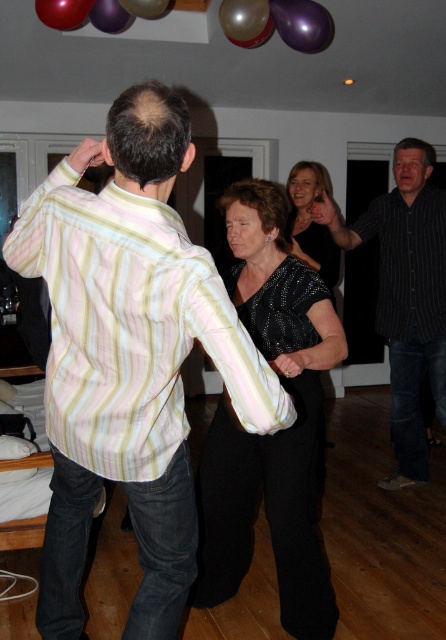
Can you confirm if striped cotton shirt at center is taller than glossy red balloon at upper left?

Indeed, striped cotton shirt at center has a greater height compared to glossy red balloon at upper left.

Is point (152, 547) behind point (37, 8)?

No, it is not.

Find the location of `striped cotton shirt at center`. striped cotton shirt at center is located at coordinates (129, 356).

Can you confirm if black sequined blouse at center is positioned to the left of striped shirt at right?

Indeed, black sequined blouse at center is positioned on the left side of striped shirt at right.

Is point (260, 451) positioned after point (371, 228)?

No.

Between point (275, 472) and point (396, 381), which one is positioned in front?

Point (275, 472) is more forward.

Locate an element on the screen. This screenshot has height=640, width=446. black sequined blouse at center is located at coordinates (276, 433).

Does striped shirt at right come behind metallic purple balloon at upper center?

No, striped shirt at right is in front of metallic purple balloon at upper center.

Can you confirm if striped shirt at right is taller than metallic purple balloon at upper center?

Indeed, striped shirt at right has a greater height compared to metallic purple balloon at upper center.

Between point (433, 240) and point (301, 49), which one is positioned in front?

Point (301, 49)

Locate an element on the screen. This screenshot has height=640, width=446. striped shirt at right is located at coordinates (405, 296).